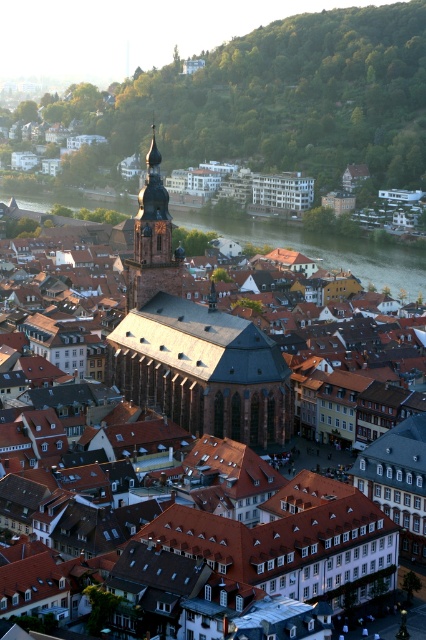
Does green water at center have a smaller size compared to smooth copper spire at center?

No.

Does green water at center have a greater height compared to smooth copper spire at center?

No.

Is point (321, 257) positioned before point (131, 296)?

That is False.

I want to click on green water at center, so click(x=327, y=250).